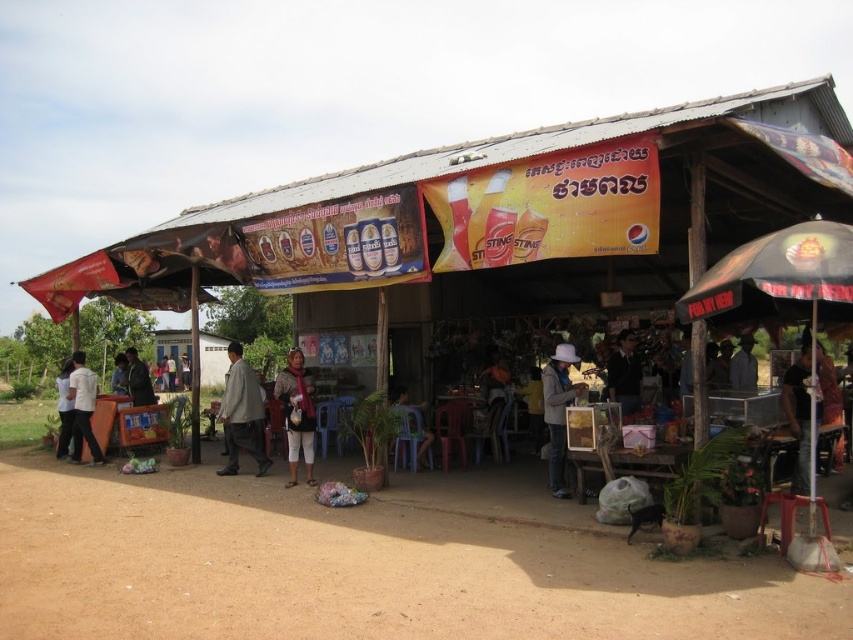
Question: Is light brown fabric jacket at center wider than white shirt at left?

Choices:
 (A) no
 (B) yes

Answer: (A)

Question: Among these points, which one is farthest from the camera?

Choices:
 (A) (73, 417)
 (B) (117, 394)
 (C) (73, 372)

Answer: (B)

Question: Can you confirm if black matte jacket at center is wider than dark brown leather jacket at center?

Choices:
 (A) no
 (B) yes

Answer: (A)

Question: Does brown dirt field at lower center appear on the right side of dark gray shirt at lower right?

Choices:
 (A) yes
 (B) no

Answer: (B)

Question: Which point is closer to the camera taking this photo?

Choices:
 (A) (750, 364)
 (B) (36, 515)
 (C) (113, 380)

Answer: (B)

Question: Which point is farther to the camera?

Choices:
 (A) brown dirt field at lower center
 (B) white shirt at left
 (C) black matte jacket at center
 (D) white felt hat at center

Answer: (B)